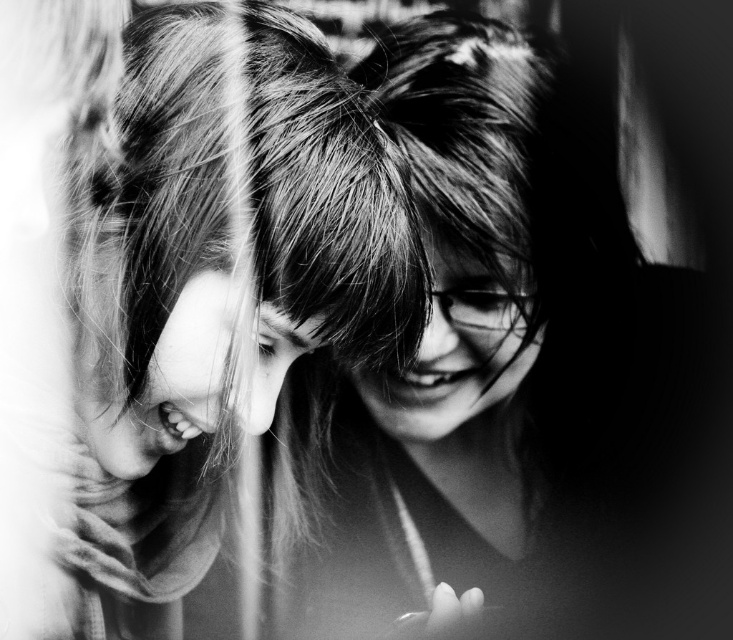
You are an artist trying to sketch the scene. You notice a specific point at coordinates point (221, 291). Based on the description, what surface would this point most likely be located on?

The point (221, 291) is on smooth hair at center.

You are a photographer who wants to capture a closeup shot of both the smooth hair at center and the shiny hair at center in the image. Given that your camera can only focus on objects within a 7 inch range, will you be able to capture both in focus?

The smooth hair at center and the shiny hair at center are 8.51 inches apart, which exceeds the camera focus range of 7 inches. Therefore, you cannot capture both in focus simultaneously.